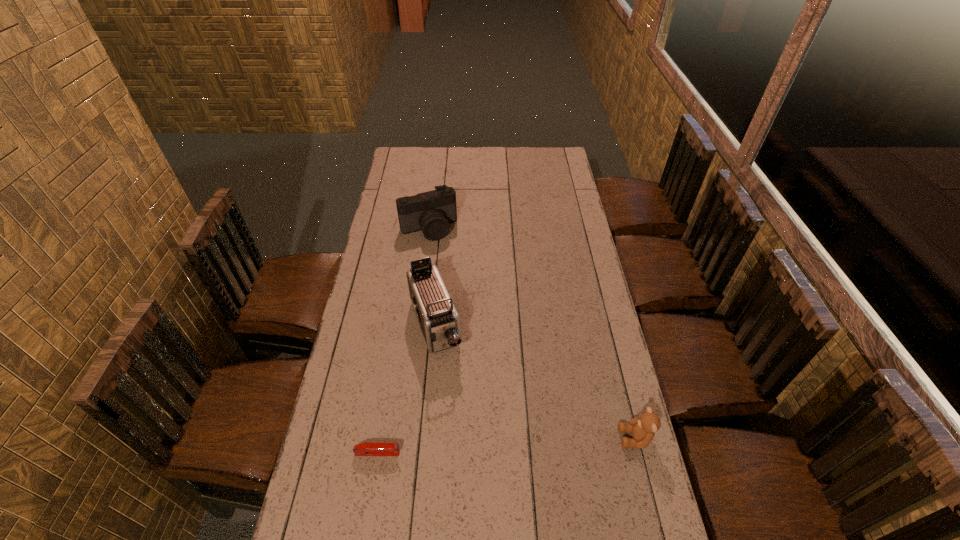
This screenshot has width=960, height=540. Identify the location of vacant space situated on the face of the teddy bear. (557, 438).

The image size is (960, 540). I want to click on free spot located at the lens of the second farthest object, so click(x=468, y=428).

The width and height of the screenshot is (960, 540). Find the location of `vacant region located 0.090m at the lens of the second farthest object`. vacant region located 0.090m at the lens of the second farthest object is located at coordinates (452, 383).

This screenshot has width=960, height=540. Identify the location of free space located 0.190m at the lens of the second farthest object. (462, 411).

The image size is (960, 540). I want to click on vacant area located 0.210m at the lens of the farthest object, so click(x=453, y=276).

Identify the location of free location located at the lens of the farthest object. The width and height of the screenshot is (960, 540). 457,283.

I want to click on vacant space positioned at the lens of the farthest object, so click(454, 278).

Locate an element on the screen. stapler that is at the left edge is located at coordinates (363, 449).

Locate an element on the screen. camera present at the left edge is located at coordinates (431, 212).

Where is `object present at the right edge`? object present at the right edge is located at coordinates (643, 428).